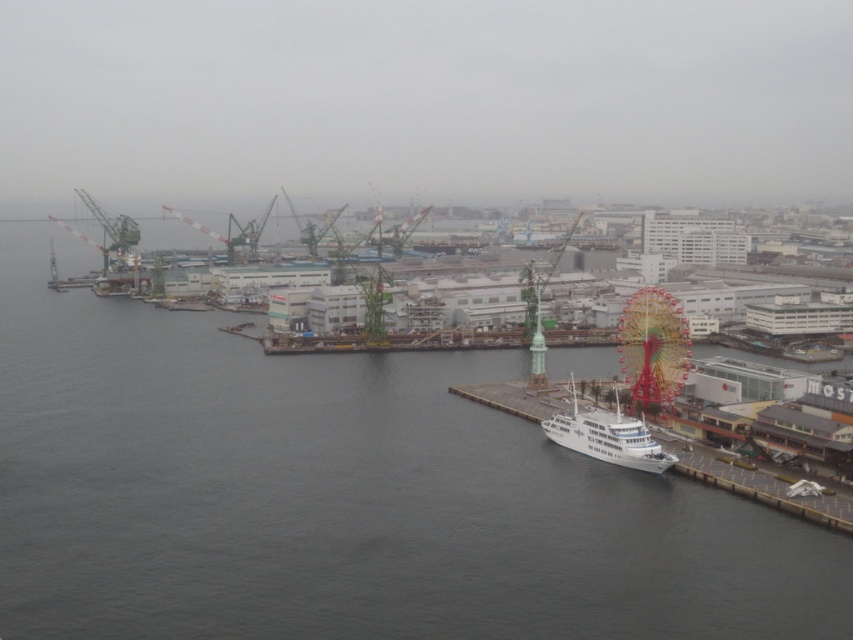
Question: Which object is positioned closest to the white glossy ship at lower right?

Choices:
 (A) white glossy dock at lower right
 (B) gray water at lower left

Answer: (A)

Question: Which object is farther from the camera taking this photo?

Choices:
 (A) white glossy ship at lower right
 (B) white glossy dock at lower right
 (C) gray water at lower left

Answer: (A)

Question: Is the position of gray water at lower left more distant than that of white glossy ship at lower right?

Choices:
 (A) no
 (B) yes

Answer: (A)

Question: Is gray water at lower left to the right of white glossy dock at lower right from the viewer's perspective?

Choices:
 (A) yes
 (B) no

Answer: (B)

Question: Estimate the real-world distances between objects in this image. Which object is farther from the white glossy ship at lower right?

Choices:
 (A) white glossy dock at lower right
 (B) gray water at lower left

Answer: (B)

Question: Can you confirm if white glossy dock at lower right is bigger than white glossy ship at lower right?

Choices:
 (A) yes
 (B) no

Answer: (A)